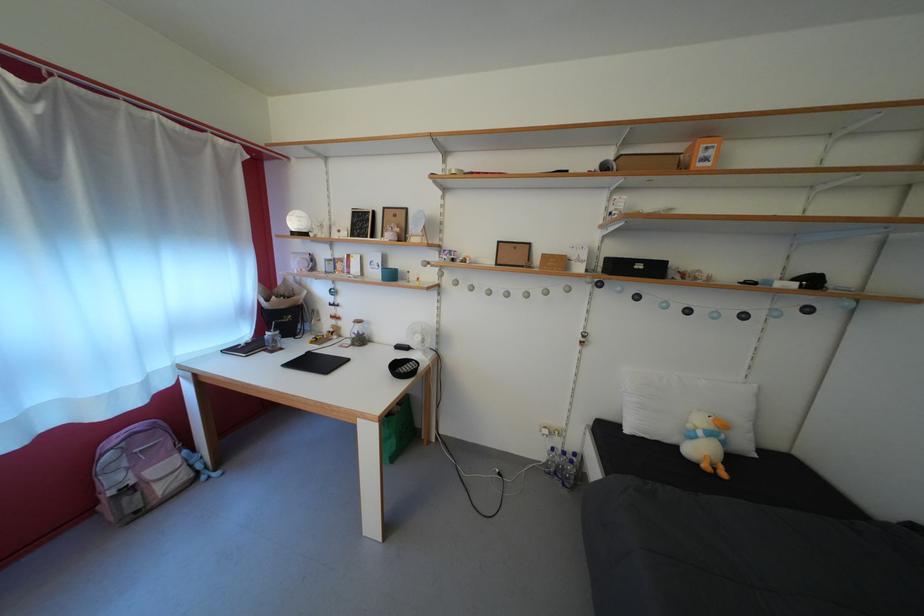
What are the coordinates of `sofa sitting surface` in the screenshot? It's located at (739, 557).